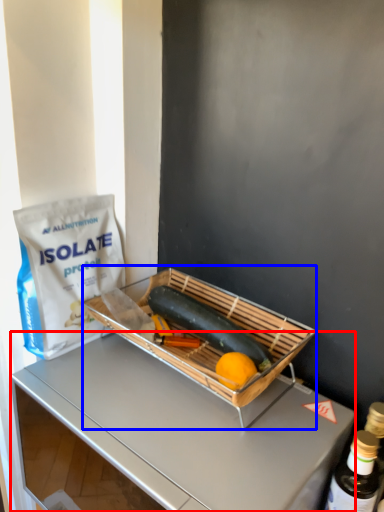
Question: Among these objects, which one is nearest to the camera, desk (highlighted by a red box) or appliance (highlighted by a blue box)?

Choices:
 (A) desk
 (B) appliance

Answer: (A)